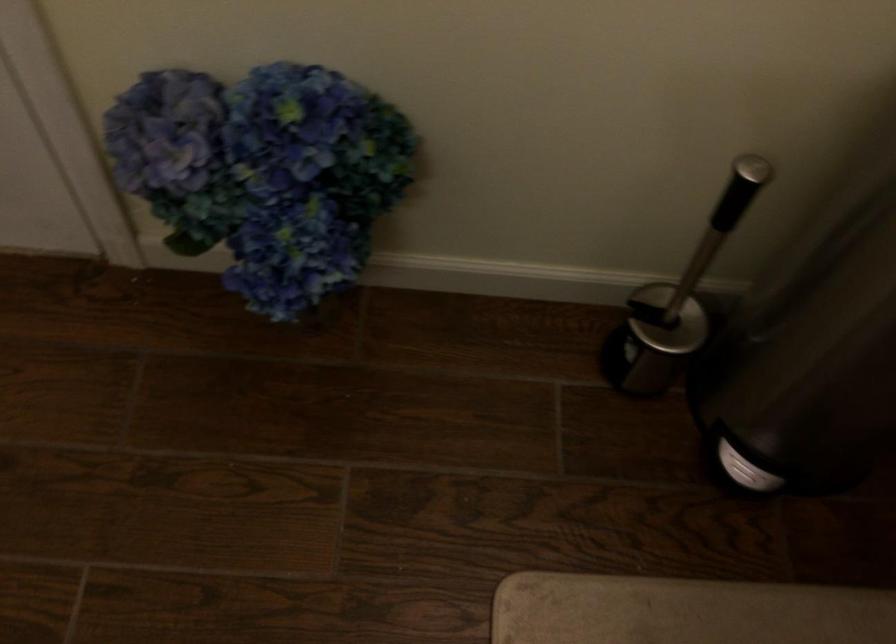
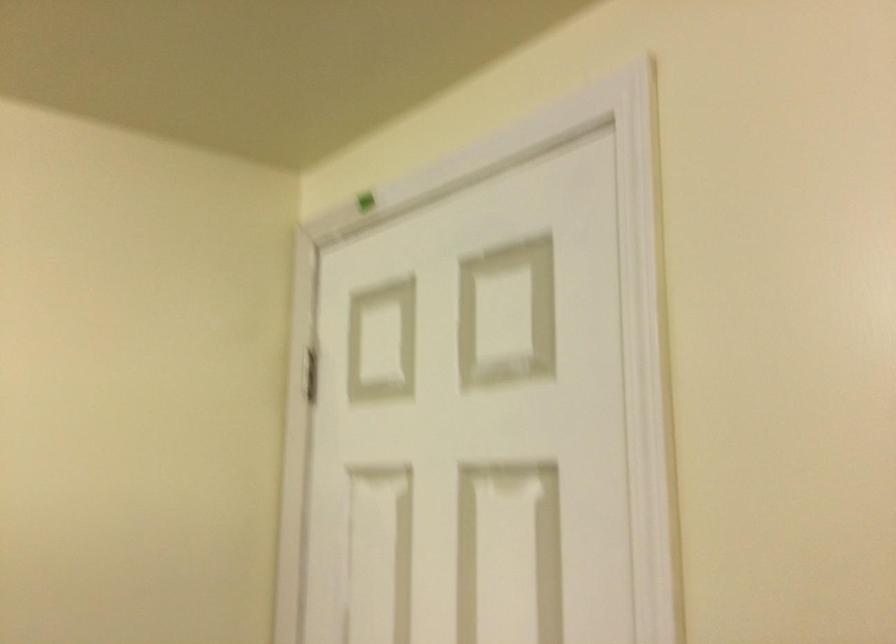
How did the camera likely rotate?

The camera rotated toward left-up.